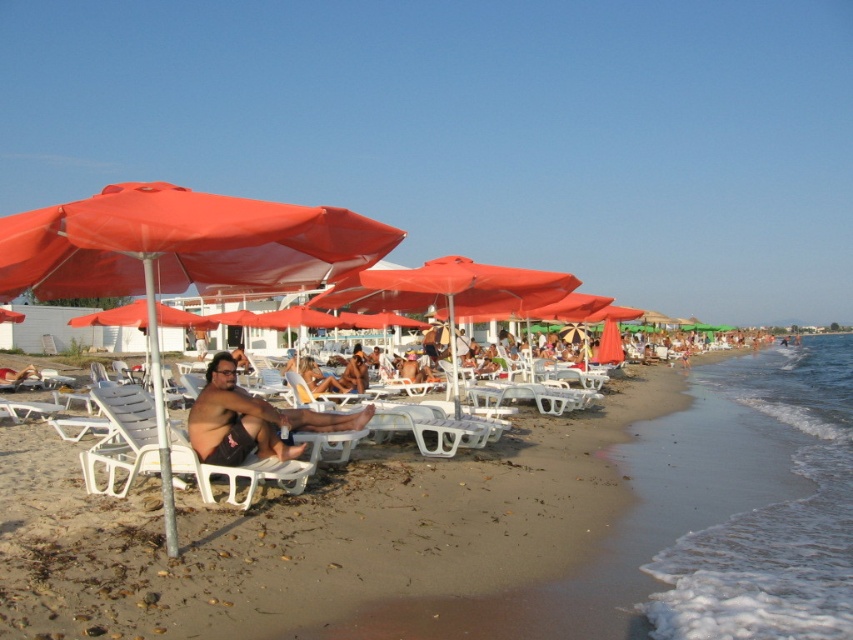
You are a photographer trying to capture a closeup of the dark brown skin at center and the white plastic beach chair at lower left. Since you want to focus on both subjects, which one should you zoom in on to ensure both are in frame without moving the camera?

You should zoom in on the white plastic beach chair at lower left because the dark brown skin at center is narrower than the white plastic beach chair at lower left, so focusing on the larger object allows both to fit within the frame.